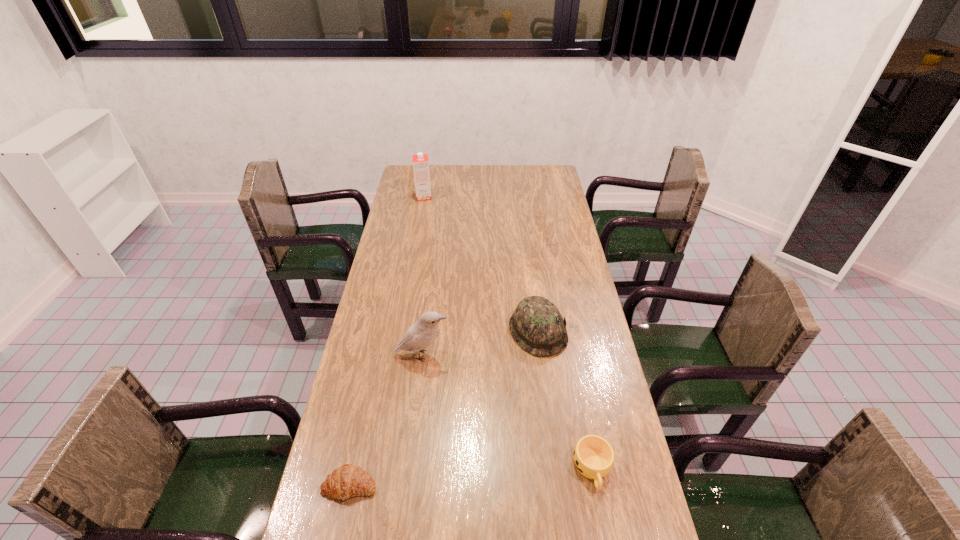
Find the location of a particular element. The height and width of the screenshot is (540, 960). carton present at the left edge is located at coordinates (420, 161).

Locate an element on the screen. This screenshot has height=540, width=960. bird situated at the left edge is located at coordinates (425, 330).

What are the coordinates of `crescent roll present at the left edge` in the screenshot? It's located at (347, 481).

Find the location of a particular element. The width and height of the screenshot is (960, 540). headwear located in the right edge section of the desktop is located at coordinates (537, 325).

This screenshot has height=540, width=960. I want to click on cup at the right edge, so click(593, 456).

The image size is (960, 540). In order to click on vacant space at the far edge in this screenshot , I will do `click(509, 173)`.

The image size is (960, 540). I want to click on vacant space at the left edge of the desktop, so click(357, 507).

Find the location of `vacant space at the right edge of the desktop`. vacant space at the right edge of the desktop is located at coordinates (560, 354).

Image resolution: width=960 pixels, height=540 pixels. What are the coordinates of `free space at the far left corner of the desktop` in the screenshot? It's located at (408, 184).

Find the location of `free space at the far right corner of the desktop`. free space at the far right corner of the desktop is located at coordinates (543, 176).